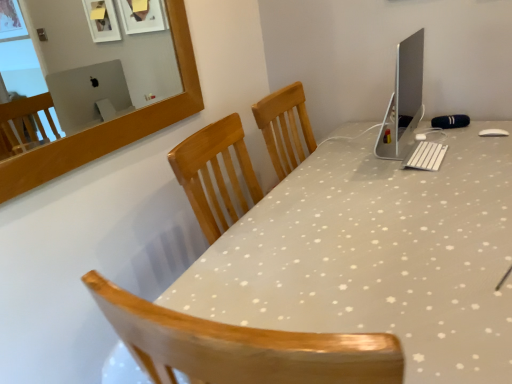
Question: From the image's perspective, is sleek silver monitor at upper right located above white plastic keyboard at center?

Choices:
 (A) no
 (B) yes

Answer: (B)

Question: Can you confirm if sleek silver monitor at upper right is positioned to the left of white plastic keyboard at center?

Choices:
 (A) no
 (B) yes

Answer: (B)

Question: Can you confirm if sleek silver monitor at upper right is thinner than white plastic keyboard at center?

Choices:
 (A) no
 (B) yes

Answer: (B)

Question: Does sleek silver monitor at upper right turn towards white plastic keyboard at center?

Choices:
 (A) yes
 (B) no

Answer: (A)

Question: Can you confirm if sleek silver monitor at upper right is shorter than white plastic keyboard at center?

Choices:
 (A) no
 (B) yes

Answer: (A)

Question: Does sleek silver monitor at upper right contain white plastic keyboard at center?

Choices:
 (A) no
 (B) yes

Answer: (A)

Question: Is white glossy desk at center oriented towards sleek silver monitor at upper right?

Choices:
 (A) yes
 (B) no

Answer: (B)

Question: Can you see white glossy desk at center touching sleek silver monitor at upper right?

Choices:
 (A) no
 (B) yes

Answer: (A)

Question: Can you confirm if white glossy desk at center is positioned to the left of sleek silver monitor at upper right?

Choices:
 (A) yes
 (B) no

Answer: (A)

Question: Does white glossy desk at center come behind sleek silver monitor at upper right?

Choices:
 (A) yes
 (B) no

Answer: (B)

Question: Does white glossy desk at center have a greater height compared to sleek silver monitor at upper right?

Choices:
 (A) no
 (B) yes

Answer: (B)

Question: Is sleek silver monitor at upper right inside white glossy desk at center?

Choices:
 (A) no
 (B) yes

Answer: (A)

Question: Considering the relative sizes of white plastic keyboard at center and sleek silver monitor at upper right in the image provided, is white plastic keyboard at center thinner than sleek silver monitor at upper right?

Choices:
 (A) no
 (B) yes

Answer: (A)